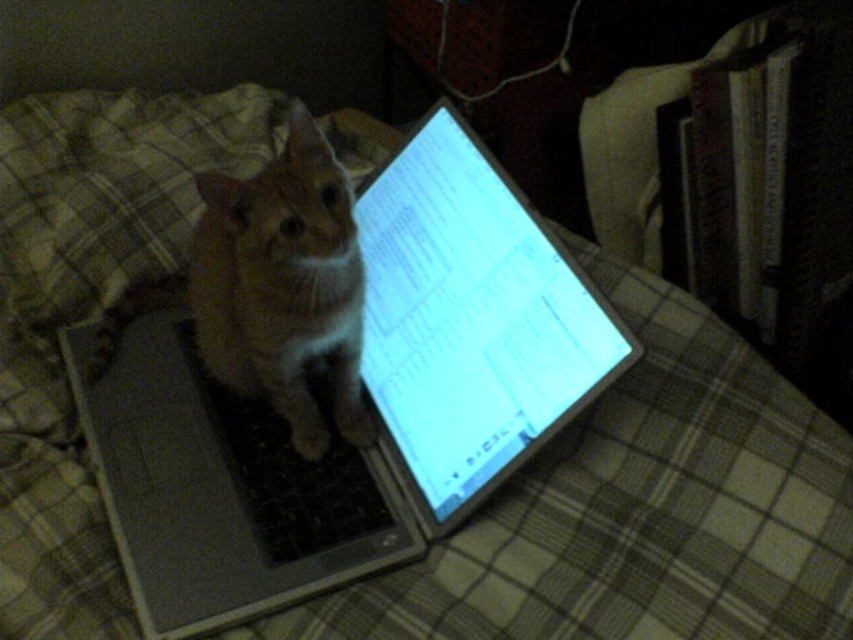
You are a photographer trying to capture the orange fur tabby cat at center in a closeup shot. Given that your camera has a focal length of 50mm and you are positioned at point 0.0, 0.0, can you determine if the cat is within the camera frame?

The orange fur tabby cat at center is located at point (x=271, y=288), so yes, the cat is within the camera frame since its coordinates fall within the camera view starting from (x=0, y=0).

You are standing in the room and want to reach the point marked as point [509,256]. If your arm can extend 75 centimeters, can you reach it without moving your feet?

The point [509,256] is 76.06 centimeters away from you, which is slightly beyond your arm reach of 75 centimeters. Therefore, you cannot reach it without moving your feet.

You are a remote worker who needs to type an urgent email. You see the silver metallic laptop at center and the orange fur tabby cat at center. Which object is blocking your keyboard?

The orange fur tabby cat at center is blocking the keyboard because the silver metallic laptop at center is positioned on its right side, meaning the cat is in front of the keyboard area.